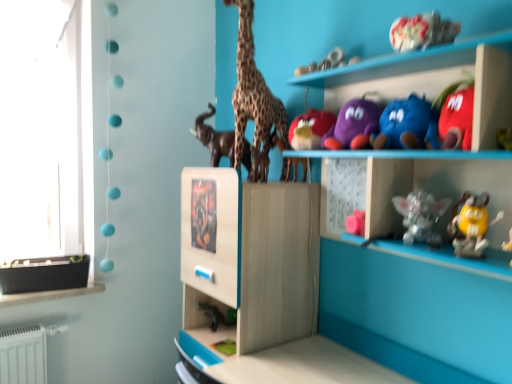
Find the location of a particular element. green rubber frog at lower center, the 1th toy positioned from the bottom is located at coordinates (225, 347).

In the scene shown: In order to face green rubber frog at lower center, which is counted as the eighth toy, starting from the top, should I rotate leftwards or rightwards?

You should rotate left by 3.446 degrees.

The width and height of the screenshot is (512, 384). Describe the element at coordinates (471, 225) in the screenshot. I see `yellow rubber duck at lower right, which appears as the seventh toy when viewed from the top` at that location.

Locate an element on the screen. The height and width of the screenshot is (384, 512). purple plush toy at upper center, marked as the 3th toy in a top-to-bottom arrangement is located at coordinates (353, 125).

Describe the element at coordinates (407, 125) in the screenshot. I see `purple plush toy at upper center, which is the fifth toy from top to bottom` at that location.

From the picture: Measure the distance between purple plush toy at upper center, which is the fifth toy from top to bottom, and camera.

The depth of purple plush toy at upper center, which is the fifth toy from top to bottom, is 3.76 feet.

What is the approximate width of matte plush bird at center, which is counted as the fifth toy, starting from the bottom?

The width of matte plush bird at center, which is counted as the fifth toy, starting from the bottom, is 6.96 inches.

Find the location of a particular element. The image size is (512, 384). black glossy elephant at center, placed as the second toy when sorted from top to bottom is located at coordinates (214, 138).

This screenshot has width=512, height=384. Find the location of `spotted fur giraffe at center`. spotted fur giraffe at center is located at coordinates (253, 99).

Is green rubber frog at lower center, the 1th toy positioned from the bottom, oriented towards satin silver figurine at center-right, which is the sixth toy in top-to-bottom order?

No.

Would you say green rubber frog at lower center, which is counted as the eighth toy, starting from the top, contains satin silver figurine at center-right, which is the sixth toy in top-to-bottom order?

That's incorrect, satin silver figurine at center-right, which is the sixth toy in top-to-bottom order, is not inside green rubber frog at lower center, which is counted as the eighth toy, starting from the top.

Who is taller, green rubber frog at lower center, which is counted as the eighth toy, starting from the top, or satin silver figurine at center-right, which is the sixth toy in top-to-bottom order?

Standing taller between the two is satin silver figurine at center-right, which is the sixth toy in top-to-bottom order.

From a real-world perspective, is green rubber frog at lower center, the 1th toy positioned from the bottom, above or below satin silver figurine at center-right, which is the sixth toy in top-to-bottom order?

green rubber frog at lower center, the 1th toy positioned from the bottom, is below satin silver figurine at center-right, which is the sixth toy in top-to-bottom order.

From a real-world perspective, who is located higher, spotted fur giraffe at center or matte plush bird at center, which is counted as the fifth toy, starting from the bottom?

spotted fur giraffe at center.

Considering the sizes of objects spotted fur giraffe at center and matte plush bird at center, the 4th toy in the top-to-bottom sequence, in the image provided, who is bigger, spotted fur giraffe at center or matte plush bird at center, the 4th toy in the top-to-bottom sequence,?

With larger size is spotted fur giraffe at center.

From the image's perspective, which one is positioned higher, spotted fur giraffe at center or matte plush bird at center, which is counted as the fifth toy, starting from the bottom?

spotted fur giraffe at center.

Is there a large distance between purple plush toy at upper center, acting as the sixth toy starting from the bottom, and yellow rubber duck at lower right, which ranks as the second toy in bottom-to-top order?

No.

From a real-world perspective, is purple plush toy at upper center, marked as the 3th toy in a top-to-bottom arrangement, beneath yellow rubber duck at lower right, which ranks as the second toy in bottom-to-top order?

No, from a real-world perspective, purple plush toy at upper center, marked as the 3th toy in a top-to-bottom arrangement, is not below yellow rubber duck at lower right, which ranks as the second toy in bottom-to-top order.

Which object is closer to the camera, purple plush toy at upper center, acting as the sixth toy starting from the bottom, or yellow rubber duck at lower right, which appears as the seventh toy when viewed from the top?

yellow rubber duck at lower right, which appears as the seventh toy when viewed from the top, is closer to the camera.

Considering the points (329, 131) and (453, 216), which point is in front, point (329, 131) or point (453, 216)?

The point (453, 216) is more forward.

From the image's perspective, which one is positioned higher, metallic silver dragon at center or matte plush bird at center, which is counted as the fifth toy, starting from the bottom?

matte plush bird at center, which is counted as the fifth toy, starting from the bottom, appears higher in the image.

Which object is thinner, metallic silver dragon at center or matte plush bird at center, the 4th toy in the top-to-bottom sequence?

With smaller width is metallic silver dragon at center.

Measure the distance between metallic silver dragon at center and matte plush bird at center, the 4th toy in the top-to-bottom sequence.

metallic silver dragon at center and matte plush bird at center, the 4th toy in the top-to-bottom sequence, are 16.75 inches apart.

Which is more to the left, metallic silver dragon at center or matte plush bird at center, which is counted as the fifth toy, starting from the bottom?

metallic silver dragon at center is more to the left.

Which object is more forward, purple plush toy at upper center, acting as the fourth toy starting from the bottom, or yellow rubber duck at lower right, which ranks as the second toy in bottom-to-top order?

Positioned in front is yellow rubber duck at lower right, which ranks as the second toy in bottom-to-top order.

Is yellow rubber duck at lower right, which ranks as the second toy in bottom-to-top order, inside purple plush toy at upper center, which is the fifth toy from top to bottom?

No, yellow rubber duck at lower right, which ranks as the second toy in bottom-to-top order, is located outside of purple plush toy at upper center, which is the fifth toy from top to bottom.

This screenshot has height=384, width=512. Identify the location of the 3rd toy to the right of the purple plush toy at upper center, acting as the fourth toy starting from the bottom, starting your count from the anchor. (471, 225).

How far apart are purple plush toy at upper center, acting as the fourth toy starting from the bottom, and yellow rubber duck at lower right, which appears as the seventh toy when viewed from the top?

purple plush toy at upper center, acting as the fourth toy starting from the bottom, and yellow rubber duck at lower right, which appears as the seventh toy when viewed from the top, are 9.56 inches apart.

Can you confirm if green rubber frog at lower center, the 1th toy positioned from the bottom, is wider than purple plush toy at upper center, acting as the sixth toy starting from the bottom?

In fact, green rubber frog at lower center, the 1th toy positioned from the bottom, might be narrower than purple plush toy at upper center, acting as the sixth toy starting from the bottom.

Between green rubber frog at lower center, the 1th toy positioned from the bottom, and purple plush toy at upper center, acting as the sixth toy starting from the bottom, which one is positioned behind?

green rubber frog at lower center, the 1th toy positioned from the bottom, is behind.

Which of these two, green rubber frog at lower center, which is counted as the eighth toy, starting from the top, or purple plush toy at upper center, marked as the 3th toy in a top-to-bottom arrangement, is bigger?

With larger size is purple plush toy at upper center, marked as the 3th toy in a top-to-bottom arrangement.

Does green rubber frog at lower center, the 1th toy positioned from the bottom, have a greater height compared to purple plush toy at upper center, acting as the sixth toy starting from the bottom?

In fact, green rubber frog at lower center, the 1th toy positioned from the bottom, may be shorter than purple plush toy at upper center, acting as the sixth toy starting from the bottom.

Based on their positions, is metallic silver dragon at center located to the left or right of black glossy elephant at center, acting as the seventh toy starting from the bottom?

Based on their positions, metallic silver dragon at center is located to the left of black glossy elephant at center, acting as the seventh toy starting from the bottom.

Identify the location of toy that is the 6th object located above the metallic silver dragon at center (from the image's perspective). The height and width of the screenshot is (384, 512). (214, 138).

Is metallic silver dragon at center looking in the opposite direction of black glossy elephant at center, acting as the seventh toy starting from the bottom?

metallic silver dragon at center is not turned away from black glossy elephant at center, acting as the seventh toy starting from the bottom.

Who is smaller, metallic silver dragon at center or black glossy elephant at center, acting as the seventh toy starting from the bottom?

With smaller size is metallic silver dragon at center.

Where is `the 2nd toy below when counting from the satin silver figurine at center-right, the third toy positioned from the bottom (from the image's perspective)`? Image resolution: width=512 pixels, height=384 pixels. the 2nd toy below when counting from the satin silver figurine at center-right, the third toy positioned from the bottom (from the image's perspective) is located at coordinates (225, 347).

At what (x,y) coordinates should I click in order to perform the action: click on giraffe to the left of matte plush bird at center, the 4th toy in the top-to-bottom sequence. Please return your answer as a coordinate pair (x, y). Looking at the image, I should click on (253, 99).

When comparing their distances from fluffy plush toy at upper center, the first toy in the top-to-bottom sequence, does matte plush bird at center, which is counted as the fifth toy, starting from the bottom, or green rubber frog at lower center, which is counted as the eighth toy, starting from the top, seem further?

The object further to fluffy plush toy at upper center, the first toy in the top-to-bottom sequence, is green rubber frog at lower center, which is counted as the eighth toy, starting from the top.

Looking at the image, which one is located further to black glossy elephant at center, placed as the second toy when sorted from top to bottom, yellow rubber duck at lower right, which appears as the seventh toy when viewed from the top, or satin silver figurine at center-right, the third toy positioned from the bottom?

yellow rubber duck at lower right, which appears as the seventh toy when viewed from the top, is further to black glossy elephant at center, placed as the second toy when sorted from top to bottom.

Estimate the real-world distances between objects in this image. Which object is further from metallic silver dragon at center, yellow rubber duck at lower right, which appears as the seventh toy when viewed from the top, or purple plush toy at upper center, marked as the 3th toy in a top-to-bottom arrangement?

Based on the image, yellow rubber duck at lower right, which appears as the seventh toy when viewed from the top, appears to be further to metallic silver dragon at center.

From the image, which object appears to be farther from green rubber frog at lower center, the 1th toy positioned from the bottom, spotted fur giraffe at center or purple plush toy at upper center, acting as the fourth toy starting from the bottom?

Based on the image, purple plush toy at upper center, acting as the fourth toy starting from the bottom, appears to be further to green rubber frog at lower center, the 1th toy positioned from the bottom.

Considering their positions, is yellow rubber duck at lower right, which ranks as the second toy in bottom-to-top order, positioned further to metallic silver dragon at center than black glossy elephant at center, placed as the second toy when sorted from top to bottom?

The object further to metallic silver dragon at center is yellow rubber duck at lower right, which ranks as the second toy in bottom-to-top order.

When comparing their distances from yellow rubber duck at lower right, which ranks as the second toy in bottom-to-top order, does green rubber frog at lower center, the 1th toy positioned from the bottom, or matte plush bird at center, the 4th toy in the top-to-bottom sequence, seem further?

green rubber frog at lower center, the 1th toy positioned from the bottom, is further to yellow rubber duck at lower right, which ranks as the second toy in bottom-to-top order.

Estimate the real-world distances between objects in this image. Which object is closer to fluffy plush toy at upper center, which ranks as the eighth toy in bottom-to-top order, satin silver figurine at center-right, which is the sixth toy in top-to-bottom order, or purple plush toy at upper center, which is the fifth toy from top to bottom?

purple plush toy at upper center, which is the fifth toy from top to bottom, is positioned closer to the anchor fluffy plush toy at upper center, which ranks as the eighth toy in bottom-to-top order.

Based on their spatial positions, is satin silver figurine at center-right, which is the sixth toy in top-to-bottom order, or green rubber frog at lower center, which is counted as the eighth toy, starting from the top, closer to spotted fur giraffe at center?

The object closer to spotted fur giraffe at center is satin silver figurine at center-right, which is the sixth toy in top-to-bottom order.

Where is `animal between purple plush toy at upper center, which is the fifth toy from top to bottom, and green rubber frog at lower center, the 1th toy positioned from the bottom, in the vertical direction`? animal between purple plush toy at upper center, which is the fifth toy from top to bottom, and green rubber frog at lower center, the 1th toy positioned from the bottom, in the vertical direction is located at coordinates (203, 215).

This screenshot has height=384, width=512. I want to click on giraffe between black glossy elephant at center, placed as the second toy when sorted from top to bottom, and matte plush bird at center, which is counted as the fifth toy, starting from the bottom, from left to right, so click(x=253, y=99).

The width and height of the screenshot is (512, 384). I want to click on toy between spotted fur giraffe at center and purple plush toy at upper center, marked as the 3th toy in a top-to-bottom arrangement, from left to right, so click(x=310, y=129).

The width and height of the screenshot is (512, 384). I want to click on giraffe between black glossy elephant at center, acting as the seventh toy starting from the bottom, and fluffy plush toy at upper center, which ranks as the eighth toy in bottom-to-top order, so click(253, 99).